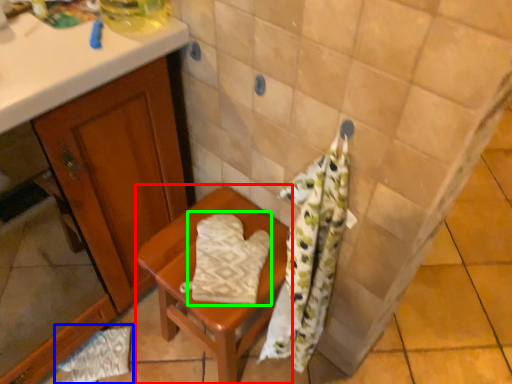
Question: Which object is positioned farthest from furniture (highlighted by a red box)? Select from material (highlighted by a blue box) and beach towel (highlighted by a green box).

Choices:
 (A) material
 (B) beach towel

Answer: (A)